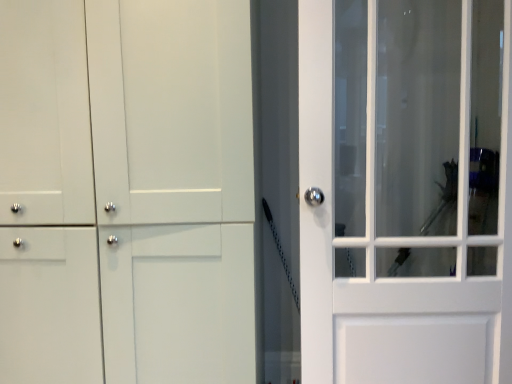
Where is `white glass door at right`? The width and height of the screenshot is (512, 384). white glass door at right is located at coordinates (406, 190).

The height and width of the screenshot is (384, 512). Describe the element at coordinates (406, 190) in the screenshot. I see `white glass door at right` at that location.

In order to face white matte cabinet at left, should I rotate leftwards or rightwards?

You should look left and rotate roughly 16.999 degrees.

What do you see at coordinates (174, 188) in the screenshot? I see `white matte cabinet at left` at bounding box center [174, 188].

Identify the location of white matte cabinet at left. (174, 188).

Where is `white glass door at right`? white glass door at right is located at coordinates (406, 190).

Which is more to the right, white glass door at right or white matte cabinet at left?

From the viewer's perspective, white glass door at right appears more on the right side.

Considering their positions, is white glass door at right located in front of or behind white matte cabinet at left?

Clearly, white glass door at right is behind white matte cabinet at left.

Does point (458, 303) come farther from viewer compared to point (148, 14)?

Yes, point (458, 303) is farther from viewer.

From the image's perspective, is white glass door at right above or below white matte cabinet at left?

Clearly, from the image's perspective, white glass door at right is above white matte cabinet at left.

From a real-world perspective, is white glass door at right positioned under white matte cabinet at left based on gravity?

No, from a real-world perspective, white glass door at right is not beneath white matte cabinet at left.

Can you confirm if white glass door at right is wider than white matte cabinet at left?

No.

Considering the sizes of objects white glass door at right and white matte cabinet at left in the image provided, who is shorter, white glass door at right or white matte cabinet at left?

Standing shorter between the two is white glass door at right.

Between white glass door at right and white matte cabinet at left, which one has larger size?

Bigger between the two is white matte cabinet at left.

Would you say white glass door at right is outside white matte cabinet at left?

Absolutely, white glass door at right is external to white matte cabinet at left.

Does white glass door at right touch white matte cabinet at left?

No, white glass door at right is not beside white matte cabinet at left.

Could you tell me if white glass door at right is turned towards white matte cabinet at left?

No.

How many degrees apart are the facing directions of white glass door at right and white matte cabinet at left?

The angle between the facing direction of white glass door at right and the facing direction of white matte cabinet at left is 2.98 degrees.

Identify the location of barn door that appears below the white glass door at right (from a real-world perspective). (174, 188).

Is white matte cabinet at left to the left or to the right of white glass door at right in the image?

white matte cabinet at left is positioned on white glass door at right's left side.

Is white matte cabinet at left further to the viewer compared to white glass door at right?

No, it is not.

Considering the positions of point (133, 67) and point (462, 154), is point (133, 67) closer or farther from the camera than point (462, 154)?

Clearly, point (133, 67) is closer to the camera than point (462, 154).

From the image's perspective, between white matte cabinet at left and white glass door at right, which one is located above?

From the image's view, white glass door at right is above.

From a real-world perspective, does white matte cabinet at left stand above white glass door at right?

No.

Is white matte cabinet at left wider or thinner than white glass door at right?

Clearly, white matte cabinet at left has more width compared to white glass door at right.

Considering the sizes of objects white matte cabinet at left and white glass door at right in the image provided, who is shorter, white matte cabinet at left or white glass door at right?

Standing shorter between the two is white glass door at right.

Is white matte cabinet at left smaller than white glass door at right?

Actually, white matte cabinet at left might be larger than white glass door at right.

Is white glass door at right inside white matte cabinet at left?

No.

Is white matte cabinet at left positioned far away from white glass door at right?

No, there isn't a large distance between white matte cabinet at left and white glass door at right.

Is white matte cabinet at left turned away from white glass door at right?

white matte cabinet at left is not turned away from white glass door at right.

Looking at this image, how many degrees apart are the facing directions of white matte cabinet at left and white glass door at right?

They differ by 2.98 degrees in their facing directions.

Locate an element on the screen. This screenshot has height=384, width=512. barn door below the white glass door at right (from a real-world perspective) is located at coordinates (174, 188).

Identify the location of door that is above the white matte cabinet at left (from a real-world perspective). (406, 190).

Locate an element on the screen. This screenshot has height=384, width=512. barn door in front of the white glass door at right is located at coordinates (174, 188).